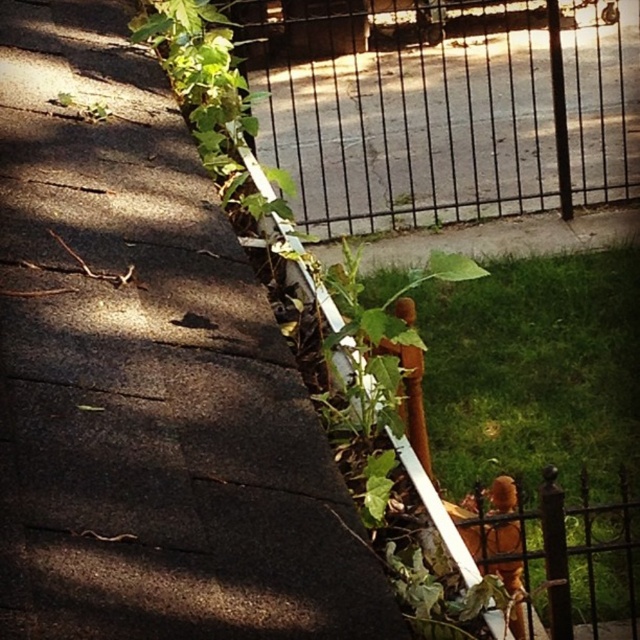
You are a gardener inspecting the roof gutter. You notice two green leafy plants growing near the gutter. Which of the two plants, the green leafy plant at upper center or the green leafy plant at center, is shorter?

The green leafy plant at upper center is shorter than the green leafy plant at center.

You are a gardener assessing the roof area. You see the black metal fence at upper center and the green leafy plant at center. Which object is taller?

The green leafy plant at center is taller than the black metal fence at upper center.